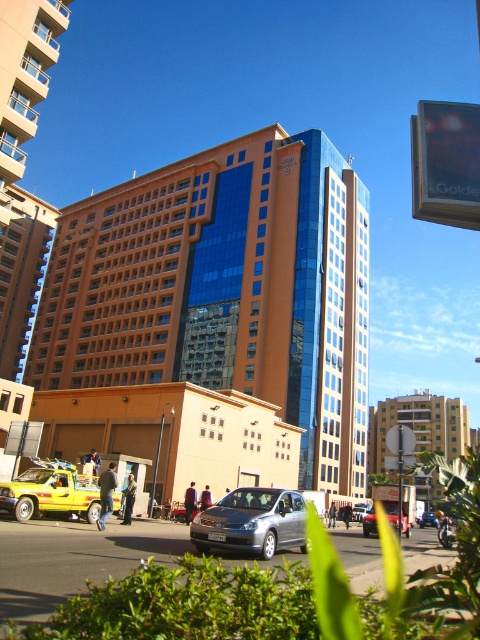
You are a delivery drone operator trying to navigate through the urban scene. The silver metallic car at center is blocking your path. Can you fly over it? Consider its position at point 0.800, 0.750.

The silver metallic car at center is located at point (360, 512). Since the car is on the ground and the drone can fly, you can safely navigate over it by adjusting your altitude above the car.

You are a pedestrian standing at the crosswalk near the yellow matte taxi at lower left and the silver metallic sedan at center. Which vehicle is closer to your right side?

The silver metallic sedan at center is closer to your right side because it is positioned to the right of the yellow matte taxi at lower left.

You are a pedestrian standing on the sidewalk and see both the metallic silver sedan at center and the silver metallic car at center. Which one is closer to you?

The metallic silver sedan at center is closer to you because it is in front of the silver metallic car at center.